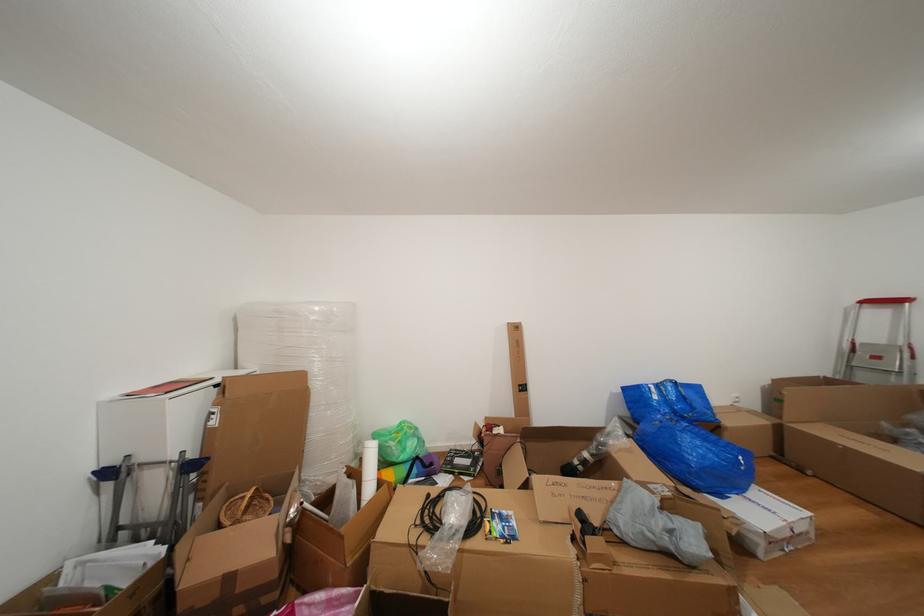
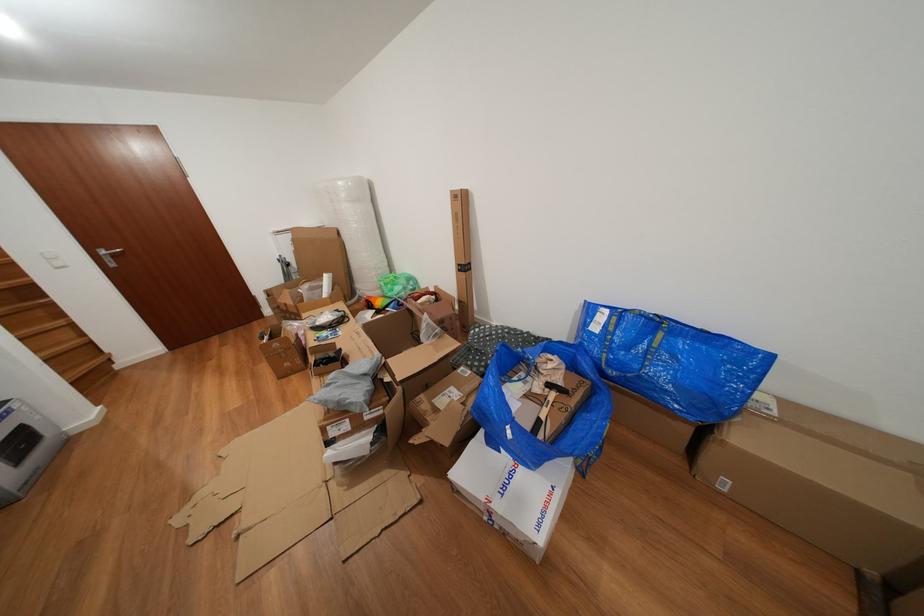
The point at [684,389] is marked in the first image. Where is the corresponding point in the second image?

(663, 328)